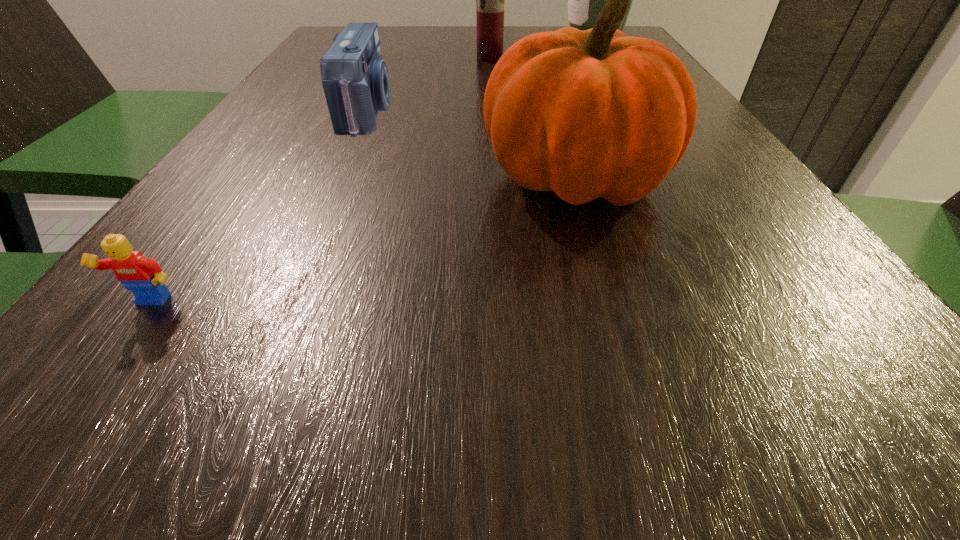
Locate an element on the screen. object located in the far right corner section of the desktop is located at coordinates (585, 0).

Find the location of `vacant space at the far edge of the desktop`. vacant space at the far edge of the desktop is located at coordinates (448, 41).

Locate an element on the screen. vacant space at the near edge of the desktop is located at coordinates (511, 396).

Locate an element on the screen. Image resolution: width=960 pixels, height=540 pixels. blank space at the left edge of the desktop is located at coordinates (215, 192).

You are a GUI agent. You are given a task and a screenshot of the screen. Output one action in this format:
    pyautogui.click(x=<x>, y=<y>)
    Task: Click on the free spot at the right edge of the desktop
    Image resolution: width=960 pixels, height=540 pixels.
    Given the screenshot: What is the action you would take?
    pyautogui.click(x=802, y=389)

The width and height of the screenshot is (960, 540). I want to click on free space at the far left corner of the desktop, so click(384, 33).

Find the location of a particular element. This screenshot has width=960, height=540. unoccupied area between the farthest object and the nearest object is located at coordinates (372, 173).

The height and width of the screenshot is (540, 960). What are the coordinates of `free space between the Lego and the second farthest object` in the screenshot? It's located at (321, 181).

Where is `empty space between the farthest object and the nearest object`? The width and height of the screenshot is (960, 540). empty space between the farthest object and the nearest object is located at coordinates (372, 173).

I want to click on empty location between the second shortest object and the shortest object, so click(x=260, y=207).